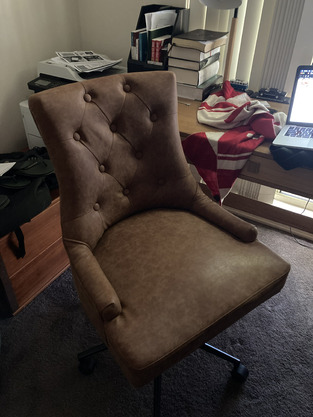
The height and width of the screenshot is (417, 313). Identify the location of books. (191, 41), (186, 58).